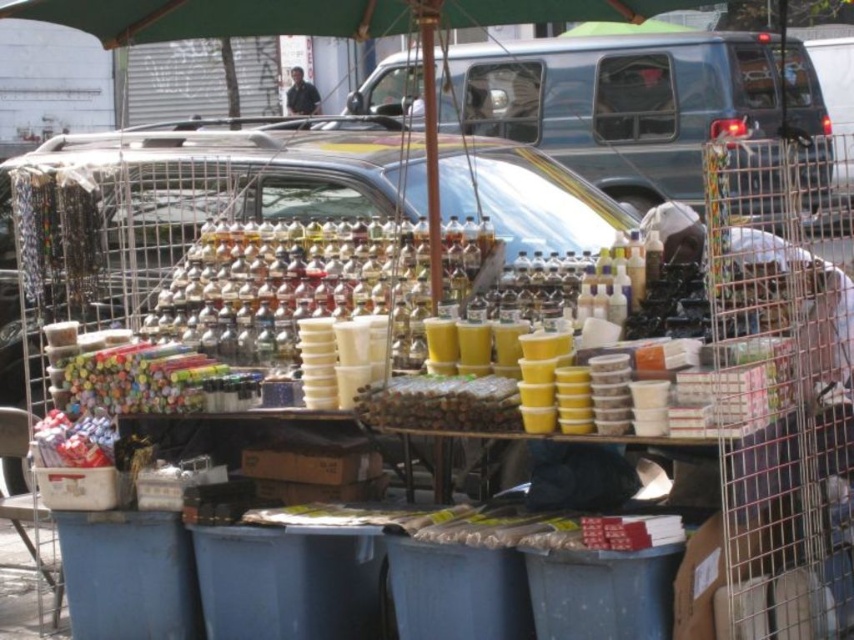
Does metallic blue van at center appear under dark blue shirt at center?

Correct, metallic blue van at center is located below dark blue shirt at center.

Who is shorter, metallic blue van at center or dark blue shirt at center?

Standing shorter between the two is dark blue shirt at center.

Does point (501, 131) come farther from viewer compared to point (287, 90)?

No, (501, 131) is closer to viewer.

You are a GUI agent. You are given a task and a screenshot of the screen. Output one action in this format:
    pyautogui.click(x=<x>, y=<y>)
    Task: Click on the metallic blue van at center
    
    Given the screenshot: What is the action you would take?
    pyautogui.click(x=617, y=102)